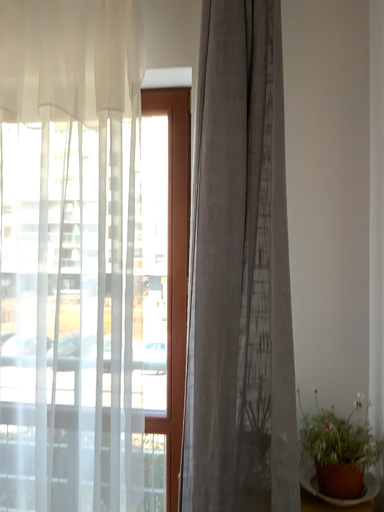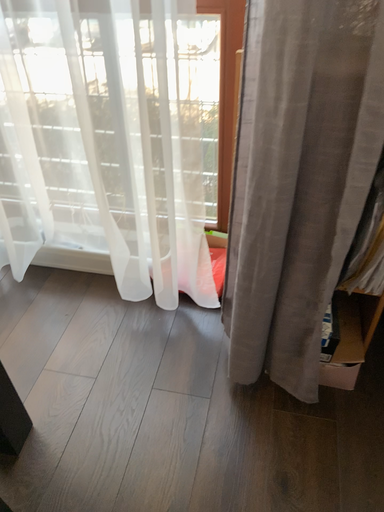
Question: Which way did the camera rotate in the video?

Choices:
 (A) rotated upward
 (B) rotated downward

Answer: (B)